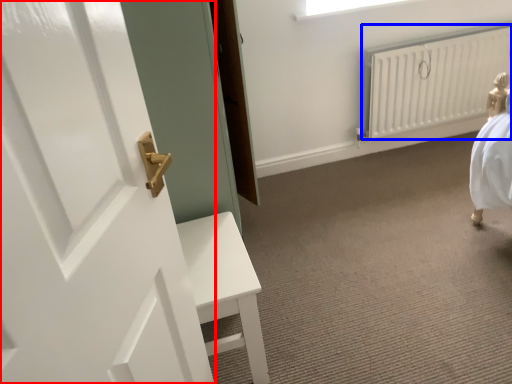
Question: Which object is further to the camera taking this photo, door (highlighted by a red box) or radiator (highlighted by a blue box)?

Choices:
 (A) door
 (B) radiator

Answer: (B)